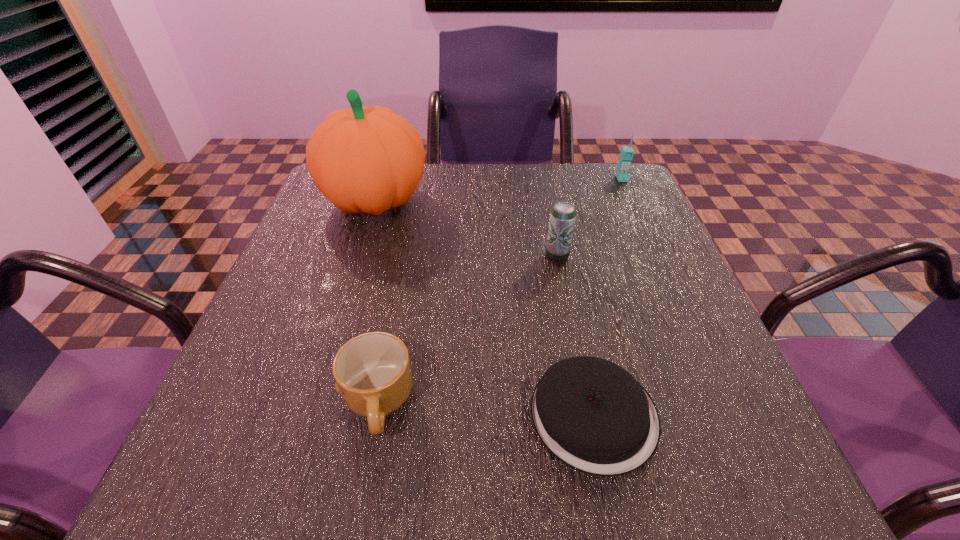
The height and width of the screenshot is (540, 960). What are the coordinates of `pumpkin` in the screenshot? It's located at (369, 160).

Image resolution: width=960 pixels, height=540 pixels. Find the location of `the rightmost object`. the rightmost object is located at coordinates (622, 174).

At what (x,y) coordinates should I click in order to perform the action: click on the third nearest object. Please return your answer as a coordinate pair (x, y). The height and width of the screenshot is (540, 960). Looking at the image, I should click on (563, 214).

You are a GUI agent. You are given a task and a screenshot of the screen. Output one action in this format:
    pyautogui.click(x=<x>, y=<y>)
    Task: Click on the mug
    
    Given the screenshot: What is the action you would take?
    pyautogui.click(x=372, y=371)

Locate an element on the screen. This screenshot has width=960, height=540. the shortest object is located at coordinates (594, 416).

This screenshot has height=540, width=960. In order to click on vacant region located on the front of the pumpkin in this screenshot , I will do `click(336, 326)`.

Identify the location of free spot located on the keypad of the rightmost object. (668, 282).

At what (x,y) coordinates should I click in order to perform the action: click on free space located on the left of the third farthest object. Please return your answer as a coordinate pair (x, y). Looking at the image, I should click on (468, 256).

Where is `blank space located 0.220m on the left of the pancake`? blank space located 0.220m on the left of the pancake is located at coordinates coord(389,415).

This screenshot has height=540, width=960. What are the coordinates of `pumpkin present at the far edge` in the screenshot? It's located at (369, 160).